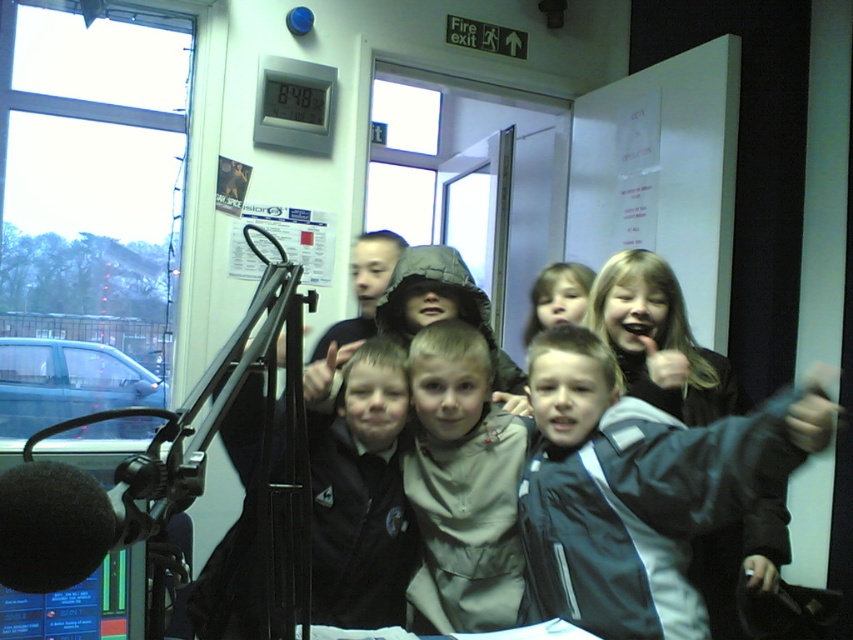
Is dark blue jacket at center smaller than smooth beige jacket at center?

Actually, dark blue jacket at center might be larger than smooth beige jacket at center.

Consider the image. Can you confirm if dark blue jacket at center is positioned to the left of smooth beige jacket at center?

In fact, dark blue jacket at center is to the right of smooth beige jacket at center.

I want to click on dark blue jacket at center, so click(637, 490).

Is black foam microphone at lower left smaller than smooth beige jacket at center?

Yes, black foam microphone at lower left is smaller than smooth beige jacket at center.

Is point (0, 499) farther from viewer compared to point (577, 275)?

No, it is in front of (577, 275).

Between point (33, 484) and point (583, 273), which one is positioned in front?

Point (33, 484) is in front.

Find the location of a particular element. The image size is (853, 640). black foam microphone at lower left is located at coordinates (57, 525).

Who is lower down, light brown fabric jacket at center or black foam microphone at lower left?

light brown fabric jacket at center is below.

Between light brown fabric jacket at center and black foam microphone at lower left, which one appears on the left side from the viewer's perspective?

black foam microphone at lower left

Is point (460, 605) closer to viewer compared to point (22, 481)?

That is False.

Where is `light brown fabric jacket at center`? The height and width of the screenshot is (640, 853). light brown fabric jacket at center is located at coordinates (462, 484).